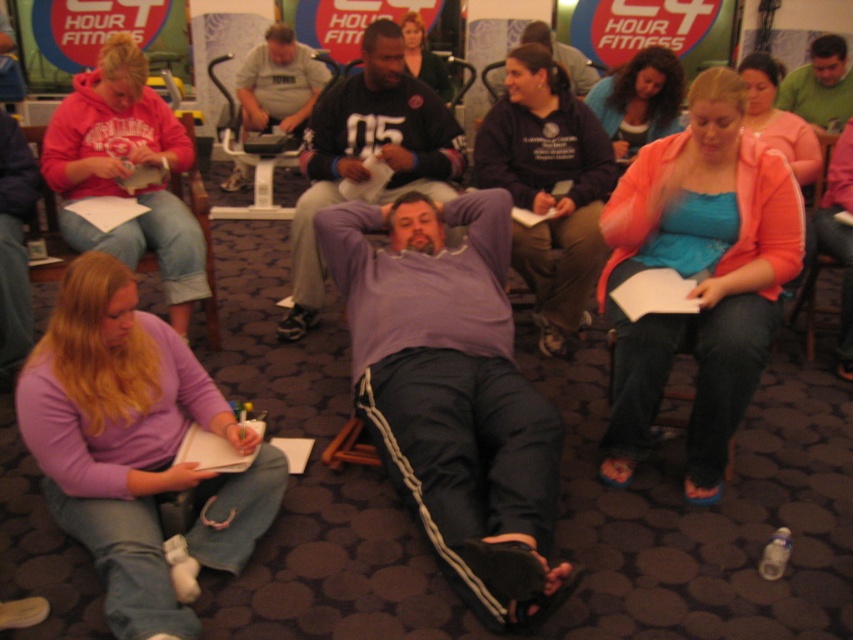
Which is more to the left, purple soft fabric shirt at lower left or matte purple shirt at center?

purple soft fabric shirt at lower left

Does point (71, 294) come in front of point (590, 77)?

Yes, it is.

Is point (70, 449) positioned in front of point (553, 58)?

Yes, point (70, 449) is in front of point (553, 58).

Image resolution: width=853 pixels, height=640 pixels. I want to click on purple soft fabric shirt at lower left, so click(135, 449).

Based on the photo, does matte pink sweater at center have a lesser height compared to matte pink hoodie at left?

No.

Does matte pink sweater at center have a smaller size compared to matte pink hoodie at left?

Indeed, matte pink sweater at center has a smaller size compared to matte pink hoodie at left.

Is point (608, 268) positioned in front of point (184, 168)?

Yes, it is.

The width and height of the screenshot is (853, 640). Find the location of `matte pink sweater at center`. matte pink sweater at center is located at coordinates (698, 276).

Between matte pink sweater at center and matte green sweater at upper center, which one is positioned lower?

Positioned lower is matte pink sweater at center.

Which of these two, matte pink sweater at center or matte green sweater at upper center, stands shorter?

matte green sweater at upper center

The height and width of the screenshot is (640, 853). In order to click on matte pink sweater at center in this screenshot , I will do point(698,276).